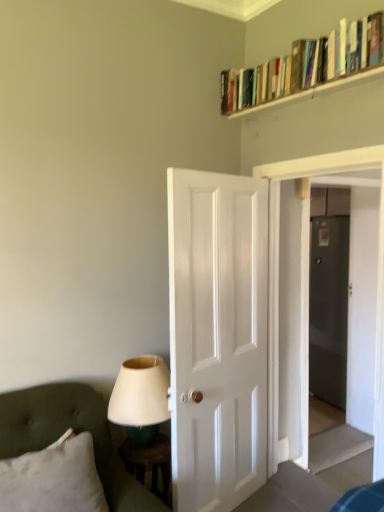
Question: Is point (301, 97) positioned closer to the camera than point (115, 380)?

Choices:
 (A) farther
 (B) closer

Answer: (B)

Question: In the image, is wooden bookshelf at upper right positioned in front of or behind matte white lampshade at lower left?

Choices:
 (A) behind
 (B) front

Answer: (B)

Question: Which object is the closest to the matte white lampshade at lower left?

Choices:
 (A) white matte door at center
 (B) transparent glass door at center, which is the 2th glass door in back-to-front order
 (C) matte gray glass door at right, the second glass door from the front
 (D) wooden bookshelf at upper right
 (E) wooden stool at lower left

Answer: (E)

Question: Which object is the closest to the transparent glass door at center, which ranks as the 1th glass door in front-to-back order?

Choices:
 (A) white matte door at center
 (B) matte white lampshade at lower left
 (C) green tufted fabric at lower left
 (D) wooden stool at lower left
 (E) white soft pillow at lower left

Answer: (A)